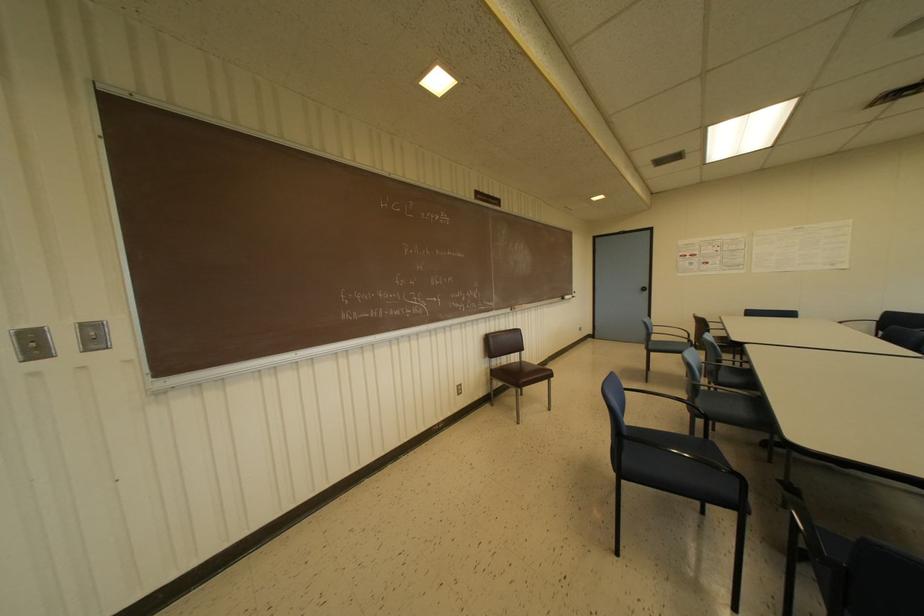
What do you see at coordinates (642, 288) in the screenshot? This screenshot has height=616, width=924. I see `the black door knob` at bounding box center [642, 288].